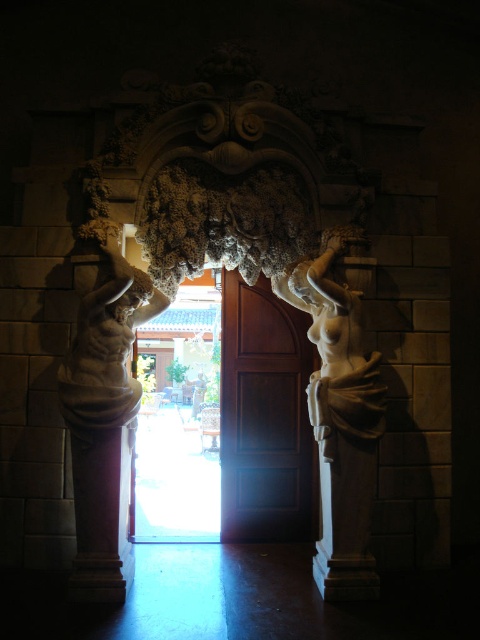
You are standing in front of an ornate doorway and want to take a photo of the white marble statue at right. If your camera can focus on objects up to 4 meters away, will it be able to capture the statue clearly?

The white marble statue at right and camera are 3.94 meters apart, so yes, the camera can focus on the statue clearly since the distance is within its 4 meter range.

You are standing in front of the doorway and want to enter through the wooden panel door at center. Which direction should you move relative to the marble statue at left to reach the door?

To reach the wooden panel door at center, you should move towards the direction of the marble statue at left since the door is located above it.

You are an architect assessing the proportions of a building entrance. Given the wooden panel door at center and the marble statue at left, which object is taller?

The wooden panel door at center is taller than the marble statue at left according to the description.